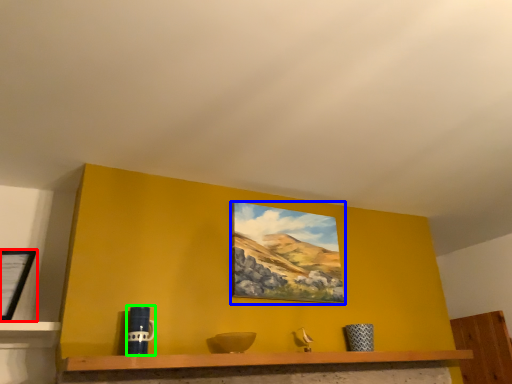
Question: Estimate the real-world distances between objects in this image. Which object is closer to picture frame (highlighted by a red box), picture frame (highlighted by a blue box) or mug (highlighted by a green box)?

Choices:
 (A) picture frame
 (B) mug

Answer: (B)